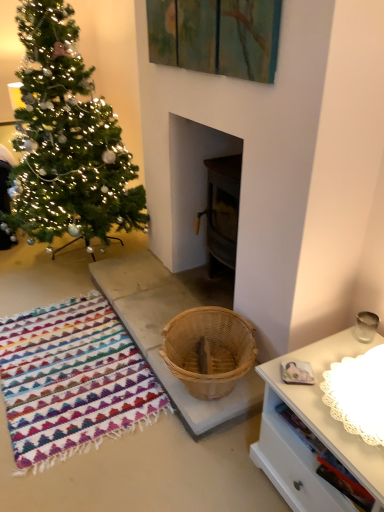
Find the location of a particular element. multicolored woven rug at lower left is located at coordinates (72, 380).

From the image's perspective, is multicolored woven rug at lower left below natural wood basket at center?

Yes, from the image's perspective, multicolored woven rug at lower left is beneath natural wood basket at center.

Considering the relative positions of multicolored woven rug at lower left and natural wood basket at center in the image provided, is multicolored woven rug at lower left behind natural wood basket at center?

No, multicolored woven rug at lower left is closer to the viewer.

Is multicolored woven rug at lower left not inside natural wood basket at center?

Yes, multicolored woven rug at lower left is not within natural wood basket at center.

Which is farther, (30, 448) or (145, 252)?

Point (145, 252)

From a real-world perspective, is green matte christmas tree at left on top of natural wood basket at center?

Yes, from a real-world perspective, green matte christmas tree at left is on top of natural wood basket at center.

Which is correct: green matte christmas tree at left is inside natural wood basket at center, or outside of it?

green matte christmas tree at left cannot be found inside natural wood basket at center.

Is green matte christmas tree at left positioned with its back to natural wood basket at center?

No.

Can you confirm if green matte christmas tree at left is wider than multicolored woven rug at lower left?

Correct, the width of green matte christmas tree at left exceeds that of multicolored woven rug at lower left.

Which object is further away from the camera, green matte christmas tree at left or multicolored woven rug at lower left?

green matte christmas tree at left.

How different are the orientations of green matte christmas tree at left and multicolored woven rug at lower left in degrees?

0.723 degrees separate the facing orientations of green matte christmas tree at left and multicolored woven rug at lower left.

Is green matte christmas tree at left oriented towards multicolored woven rug at lower left?

No, green matte christmas tree at left does not turn towards multicolored woven rug at lower left.

From the image's perspective, is multicolored woven rug at lower left below green matte christmas tree at left?

Yes, from the image's perspective, multicolored woven rug at lower left is beneath green matte christmas tree at left.

Are multicolored woven rug at lower left and green matte christmas tree at left making contact?

No, multicolored woven rug at lower left is not making contact with green matte christmas tree at left.

In terms of size, does multicolored woven rug at lower left appear bigger or smaller than green matte christmas tree at left?

multicolored woven rug at lower left is smaller than green matte christmas tree at left.

Between multicolored woven rug at lower left and green matte christmas tree at left, which one has smaller width?

With smaller width is multicolored woven rug at lower left.

Which is less distant, (126, 297) or (19, 392)?

Positioned in front is point (19, 392).

Can you confirm if natural wood basket at center is shorter than multicolored woven rug at lower left?

In fact, natural wood basket at center may be taller than multicolored woven rug at lower left.

Can you confirm if natural wood basket at center is smaller than multicolored woven rug at lower left?

Incorrect, natural wood basket at center is not smaller in size than multicolored woven rug at lower left.

The width and height of the screenshot is (384, 512). I want to click on concrete on the right of multicolored woven rug at lower left, so click(x=166, y=324).

Considering the relative positions of natural wood basket at center and green matte christmas tree at left in the image provided, is natural wood basket at center in front of green matte christmas tree at left?

Yes, natural wood basket at center is closer to the viewer.

Consider the image. Is natural wood basket at center spatially inside green matte christmas tree at left, or outside of it?

natural wood basket at center cannot be found inside green matte christmas tree at left.

From the image's perspective, is natural wood basket at center beneath green matte christmas tree at left?

Correct, natural wood basket at center appears lower than green matte christmas tree at left in the image.

Is natural wood basket at center looking in the opposite direction of green matte christmas tree at left?

No, natural wood basket at center's orientation is not away from green matte christmas tree at left.

Where is `blanket that appears on the left of natural wood basket at center`? This screenshot has width=384, height=512. blanket that appears on the left of natural wood basket at center is located at coordinates (72, 380).

There is a natural wood basket at center. Identify the location of christmas tree above it (from a real-world perspective). (67, 139).

Looking at the image, which one is located closer to multicolored woven rug at lower left, green matte christmas tree at left or natural wood basket at center?

natural wood basket at center is positioned closer to the anchor multicolored woven rug at lower left.

From the image, which object appears to be nearer to green matte christmas tree at left, multicolored woven rug at lower left or natural wood basket at center?

natural wood basket at center is positioned closer to the anchor green matte christmas tree at left.

Which object lies further to the anchor point green matte christmas tree at left, natural wood basket at center or multicolored woven rug at lower left?

Among the two, multicolored woven rug at lower left is located further to green matte christmas tree at left.

Looking at the image, which one is located further to natural wood basket at center, green matte christmas tree at left or multicolored woven rug at lower left?

green matte christmas tree at left lies further to natural wood basket at center than the other object.

When comparing their distances from multicolored woven rug at lower left, does natural wood basket at center or green matte christmas tree at left seem closer?

Among the two, natural wood basket at center is located nearer to multicolored woven rug at lower left.

Estimate the real-world distances between objects in this image. Which object is closer to natural wood basket at center, multicolored woven rug at lower left or green matte christmas tree at left?

Based on the image, multicolored woven rug at lower left appears to be nearer to natural wood basket at center.

Find the location of a particular element. concrete between green matte christmas tree at left and multicolored woven rug at lower left in the vertical direction is located at coordinates (166, 324).